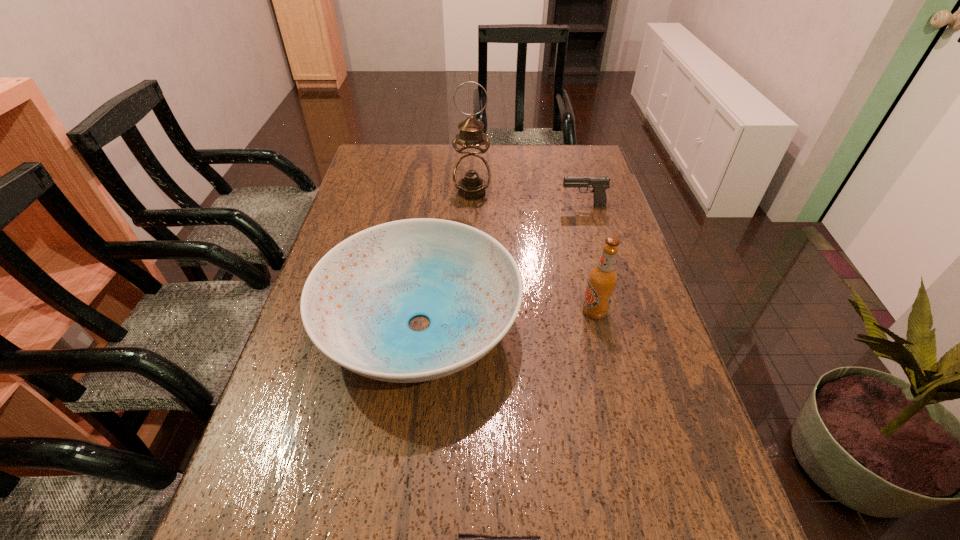
Identify the location of blank area located 0.220m on the right of the third tallest object. The width and height of the screenshot is (960, 540). (612, 325).

The width and height of the screenshot is (960, 540). Find the location of `vacant space situated aim along the barrel of the second shortest object`. vacant space situated aim along the barrel of the second shortest object is located at coordinates (459, 205).

This screenshot has height=540, width=960. In order to click on vacant space located 0.110m aim along the barrel of the second shortest object in this screenshot , I will do `click(526, 205)`.

This screenshot has height=540, width=960. I want to click on free spot located 0.290m aim along the barrel of the second shortest object, so click(x=468, y=205).

The image size is (960, 540). What are the coordinates of `object present at the left edge` in the screenshot? It's located at (356, 304).

The height and width of the screenshot is (540, 960). I want to click on beer bottle present at the right edge, so click(603, 278).

What are the coordinates of `pistol that is at the right edge` in the screenshot? It's located at (599, 184).

Image resolution: width=960 pixels, height=540 pixels. What are the coordinates of `vacant space at the far edge of the desktop` in the screenshot? It's located at (412, 166).

Where is `vacant space at the left edge`? This screenshot has width=960, height=540. vacant space at the left edge is located at coordinates (317, 443).

You are a GUI agent. You are given a task and a screenshot of the screen. Output one action in this format:
    pyautogui.click(x=<x>, y=<y>)
    Task: Click on the vacant space at the right edge of the desktop
    
    Given the screenshot: What is the action you would take?
    pyautogui.click(x=603, y=244)